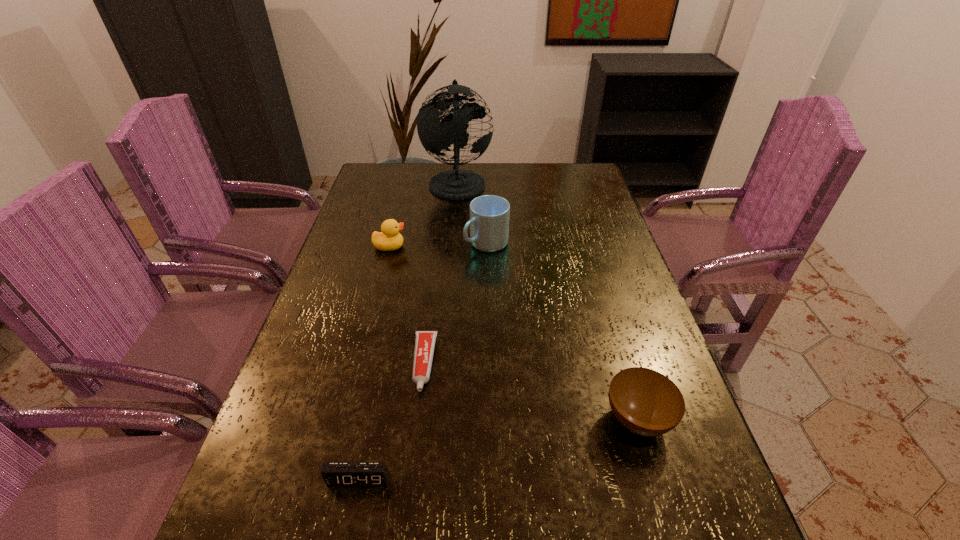
In the image, there is a desktop. Where is `vacant area at the left edge`? This screenshot has height=540, width=960. vacant area at the left edge is located at coordinates (361, 318).

Image resolution: width=960 pixels, height=540 pixels. Find the location of `free space at the right edge of the desktop`. free space at the right edge of the desktop is located at coordinates (601, 275).

In the image, there is a desktop. In order to click on vacant space at the far left corner in this screenshot , I will do `click(369, 184)`.

You are a GUI agent. You are given a task and a screenshot of the screen. Output one action in this format:
    pyautogui.click(x=<x>, y=<y>)
    Task: Click on the vacant space at the far right corner
    
    Given the screenshot: What is the action you would take?
    pyautogui.click(x=582, y=173)

In order to click on free space between the shortest object and the duck in this screenshot , I will do `click(407, 305)`.

You are a GUI agent. You are given a task and a screenshot of the screen. Output one action in this format:
    pyautogui.click(x=<x>, y=<y>)
    Task: Click on the vacant point located between the tallest object and the duck
    This screenshot has height=540, width=960.
    Given the screenshot: What is the action you would take?
    pyautogui.click(x=423, y=214)

This screenshot has width=960, height=540. In order to click on free spot between the duck and the fifth tallest object in this screenshot , I will do `click(374, 363)`.

Find the location of a particular element. Image resolution: width=960 pixels, height=540 pixels. vacant space that is in between the nearest object and the toothpaste is located at coordinates (392, 421).

At what (x,y) coordinates should I click in order to perform the action: click on unoccupied area between the duck and the tallest object. Please return your answer as a coordinate pair (x, y). This screenshot has width=960, height=540. Looking at the image, I should click on (423, 214).

At what (x,y) coordinates should I click in order to perform the action: click on unoccupied area between the mug and the toothpaste. Please return your answer as a coordinate pair (x, y). Looking at the image, I should click on (455, 303).